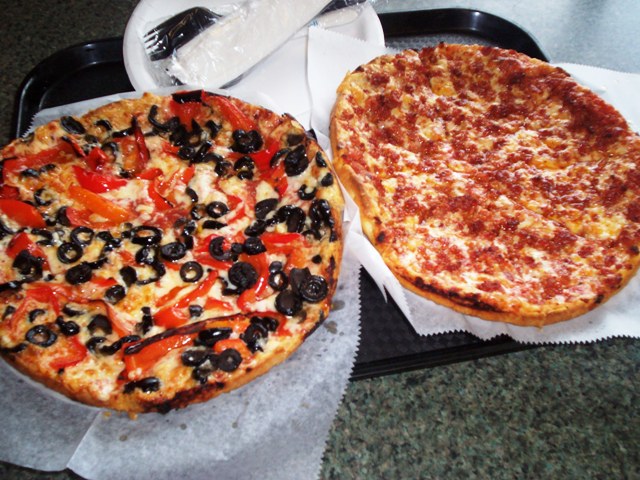
Locate an element on the screen. This screenshot has height=480, width=640. sheet is located at coordinates (282, 401).